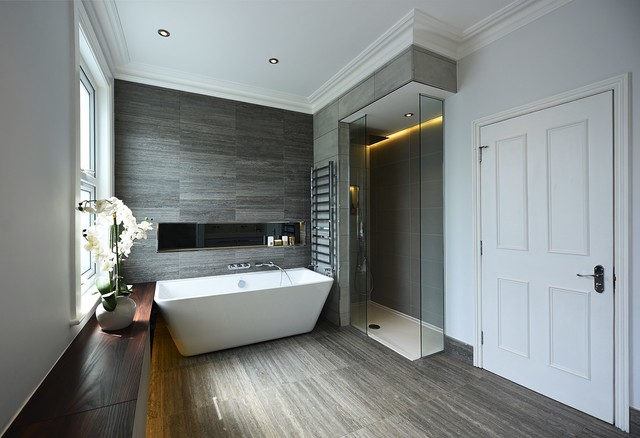
I want to click on ceiling, so click(240, 26).